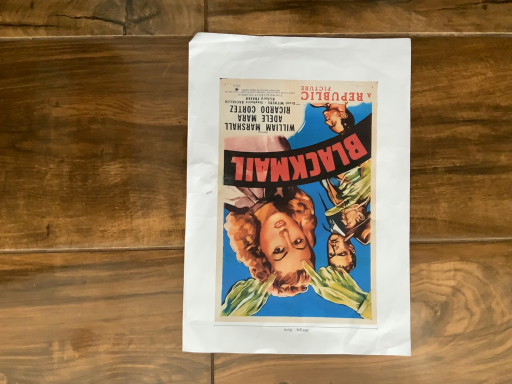
The height and width of the screenshot is (384, 512). Identify the location of vacant space situated above vivid paper poster at center (from a real-world perspective). (304, 177).